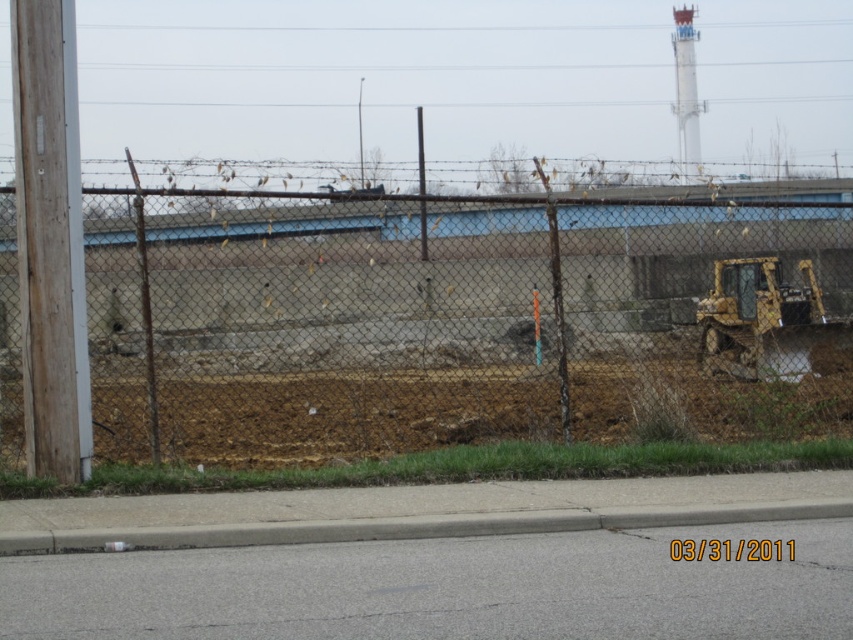
Question: Estimate the real-world distances between objects in this image. Which object is farther from the gray concrete curb at lower center?

Choices:
 (A) yellow metallic excavator at right
 (B) rusty chain-link fence at center

Answer: (A)

Question: Is rusty chain-link fence at center smaller than yellow metallic excavator at right?

Choices:
 (A) yes
 (B) no

Answer: (A)

Question: Estimate the real-world distances between objects in this image. Which object is closer to the gray concrete curb at lower center?

Choices:
 (A) yellow metallic excavator at right
 (B) rusty chain-link fence at center

Answer: (B)

Question: Is rusty chain-link fence at center bigger than gray concrete curb at lower center?

Choices:
 (A) no
 (B) yes

Answer: (A)

Question: Which is farther from the rusty chain-link fence at center?

Choices:
 (A) yellow metallic excavator at right
 (B) gray concrete curb at lower center

Answer: (A)

Question: Does gray concrete curb at lower center have a lesser width compared to yellow metallic excavator at right?

Choices:
 (A) no
 (B) yes

Answer: (A)